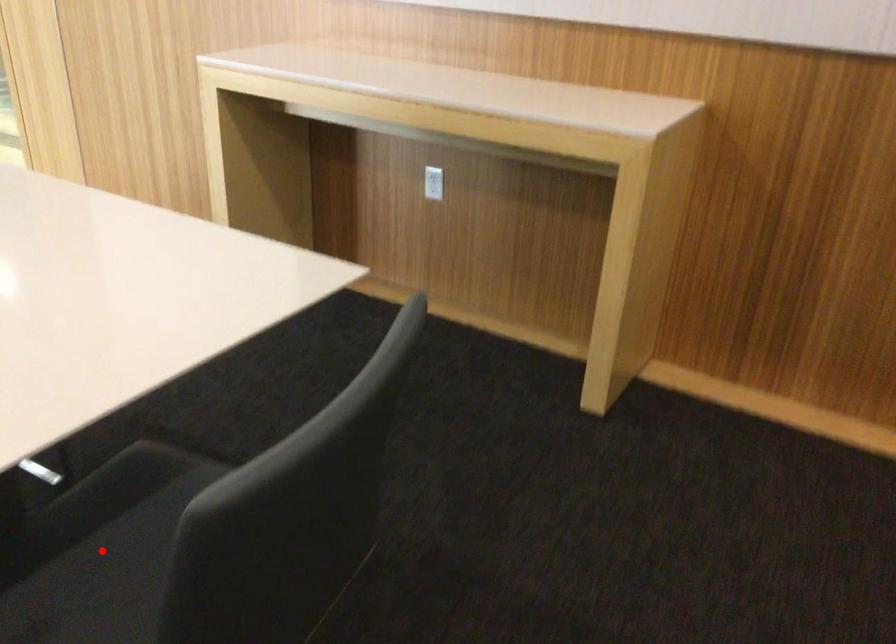
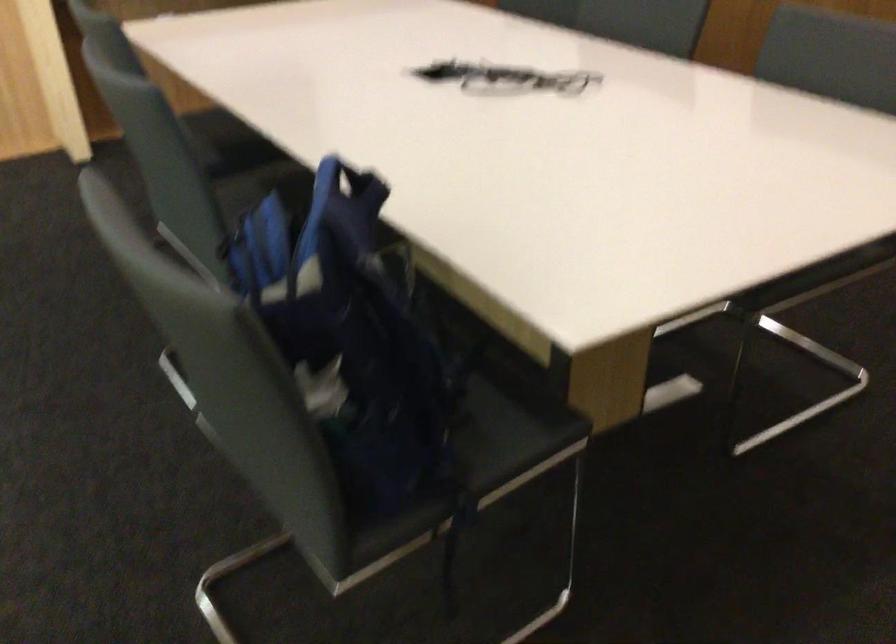
Question: I am providing you with two images of the same scene from different viewpoints. A red point is marked on the first image. At the location where the point appears in image 1, is it still visible in image 2?

Choices:
 (A) Yes
 (B) No

Answer: (B)